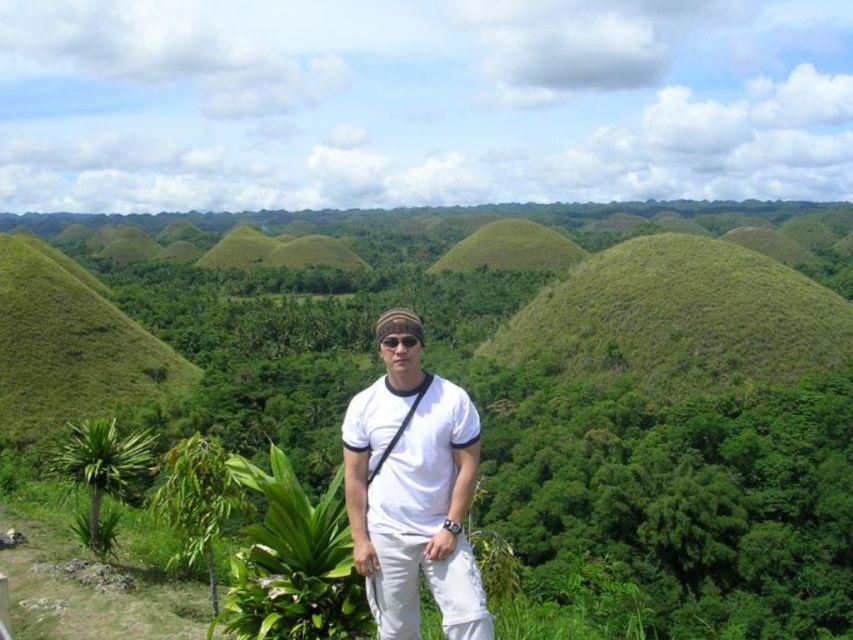
You are taking a photo of the person in the scene. The camera is at your eye level. Which point, point (843, 570) or point (738, 333), will appear closer to the center of the photo?

Point (843, 570) is closer to the camera than point (738, 333), so it will appear closer to the center of the photo.

You are standing at the base of the hills in the image and want to reach the point marked at coordinates point (645, 442). If your walking speed is 5 km per hour, approximately how many minutes will it take to reach that point?

The distance to point (645, 442) is 97.71 meters. Converting 5 km per hour to meters per minute gives 5000 meters per 60 minutes, which is about 83.33 meters per minute. Dividing 97.71 by 83.33 gives approximately 1.17 minutes, so it would take roughly 1 minute and 10 seconds to reach the point.

You are a photographer trying to capture the perfect shot of the person in the scene. You notice two points marked in the image at coordinates point (276, 227) and point (384, 348). To ensure depth of field, you need to know which point is closer to the camera. Which point should you focus on to capture both points clearly?

Point (276, 227) is further to the camera than point (384, 348). To capture both points clearly, you should focus on the point that is further away, which is point (276, 227), as it requires the camera to focus on the furthest subject for better depth of field.